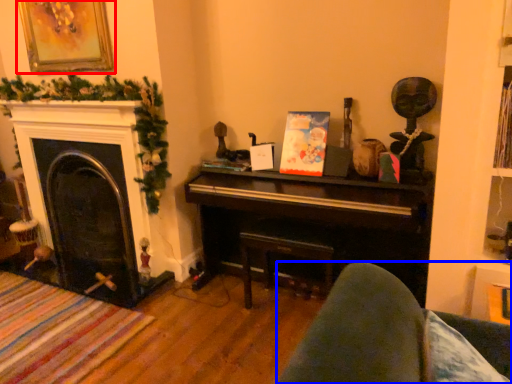
Question: Which point is further to the camera, picture frame (highlighted by a red box) or rocking chair (highlighted by a blue box)?

Choices:
 (A) picture frame
 (B) rocking chair

Answer: (A)